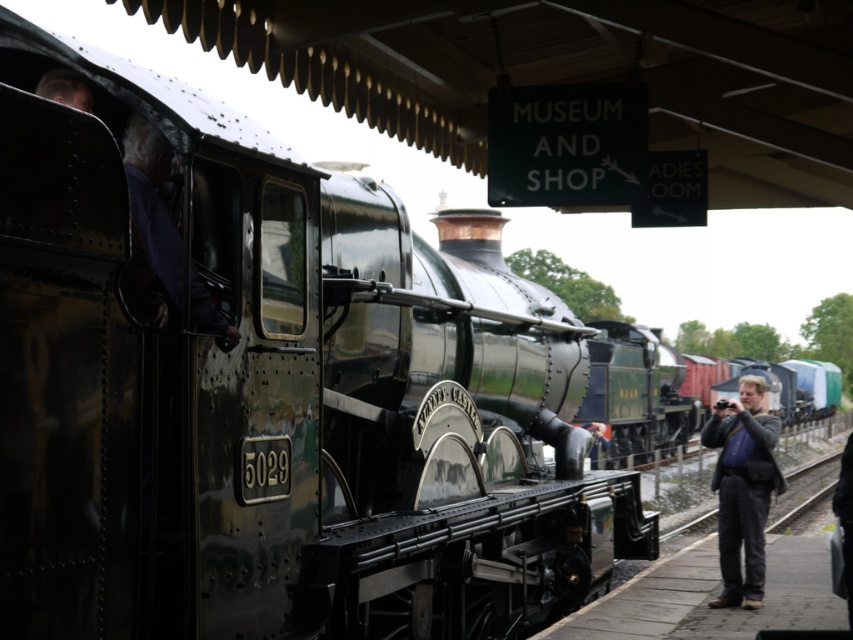
You are a passenger waiting at the station and see both the dark gray jacket at right and the purple fabric at center. Which object is closer to you?

The dark gray jacket at right is closer to you because the purple fabric at center is behind it.

Looking at this image, you are a photographer standing on the platform at the railway station. You notice a dark gray jacket at right and a purple fabric at center. Which object is wider?

The dark gray jacket at right is wider than the purple fabric at center because its width surpasses the purple fabric at center.

You are a photographer standing on the platform at the railway station. You want to take a photo of the purple fabric at center and the dark gray jacket at right. Which object should you focus on first if you want to capture both in the same frame without moving the camera?

The purple fabric at center is closer to the photographer than the dark gray jacket at right. To capture both in the same frame without moving the camera, focus on the purple fabric at center first, as it is closer, and the dark gray jacket at right will naturally fall into the background of the frame.